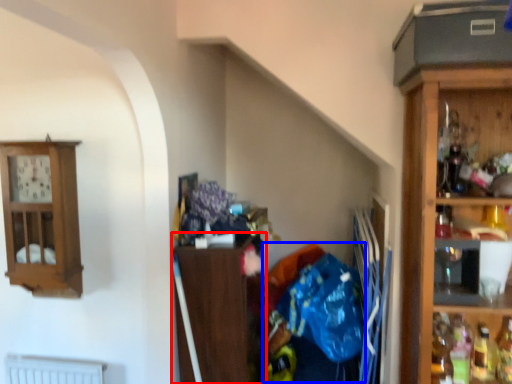
Question: Which point is further to the camera, cabinetry (highlighted by a red box) or waste (highlighted by a blue box)?

Choices:
 (A) cabinetry
 (B) waste

Answer: (A)